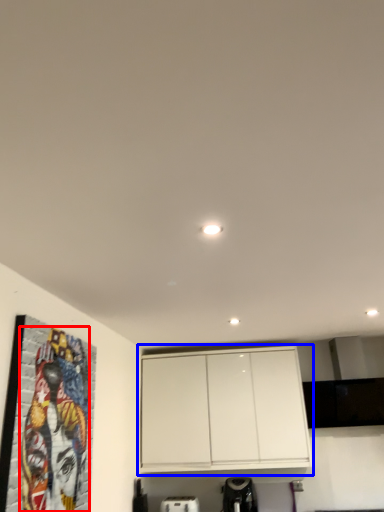
Question: Which point is further to the camera, mural (highlighted by a red box) or cabinetry (highlighted by a blue box)?

Choices:
 (A) mural
 (B) cabinetry

Answer: (B)